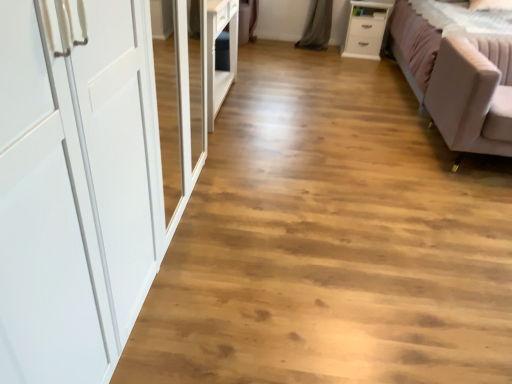
The image size is (512, 384). What do you see at coordinates (331, 240) in the screenshot?
I see `matte white wardrobe at left` at bounding box center [331, 240].

Image resolution: width=512 pixels, height=384 pixels. I want to click on white glossy chest of drawers at upper right, so click(x=365, y=28).

Where is `plain below the white glossy chest of drawers at upper right (from the image's perspective)`? This screenshot has width=512, height=384. plain below the white glossy chest of drawers at upper right (from the image's perspective) is located at coordinates click(x=331, y=240).

Based on the photo, considering the sizes of objects matte white wardrobe at left and white glossy chest of drawers at upper right in the image provided, who is shorter, matte white wardrobe at left or white glossy chest of drawers at upper right?

matte white wardrobe at left.

Does matte white wardrobe at left have a lesser width compared to white glossy chest of drawers at upper right?

No.

Which is correct: matte white wardrobe at left is inside white glossy chest of drawers at upper right, or outside of it?

matte white wardrobe at left exists outside the volume of white glossy chest of drawers at upper right.

Can matte white wardrobe at left be found inside white glossy chest of drawers at upper right?

No, white glossy chest of drawers at upper right does not contain matte white wardrobe at left.

From the image's perspective, does white glossy chest of drawers at upper right appear higher than matte white wardrobe at left?

Yes, from the image's perspective, white glossy chest of drawers at upper right is over matte white wardrobe at left.

Can you tell me how much white glossy chest of drawers at upper right and matte white wardrobe at left differ in facing direction?

The angle between the facing direction of white glossy chest of drawers at upper right and the facing direction of matte white wardrobe at left is 1.02 degrees.

Between point (360, 15) and point (374, 221), which one is positioned in front?

The point (374, 221) is more forward.

Considering the relative positions of white glossy chest of drawers at upper right and light pink fabric studio couch at right in the image provided, is white glossy chest of drawers at upper right to the right of light pink fabric studio couch at right from the viewer's perspective?

Incorrect, white glossy chest of drawers at upper right is not on the right side of light pink fabric studio couch at right.

Between point (371, 58) and point (494, 132), which one is positioned in front?

The point (494, 132) is in front.

In the scene shown: From a real-world perspective, which object rests below the other?

From a 3D spatial view, white glossy chest of drawers at upper right is below.

Can you confirm if white glossy chest of drawers at upper right is bigger than light pink fabric studio couch at right?

Incorrect, white glossy chest of drawers at upper right is not larger than light pink fabric studio couch at right.

Is point (466, 74) behind point (451, 344)?

Yes, it is.

Considering the sizes of light pink fabric studio couch at right and matte white wardrobe at left in the image, is light pink fabric studio couch at right bigger or smaller than matte white wardrobe at left?

Clearly, light pink fabric studio couch at right is larger in size than matte white wardrobe at left.

In terms of height, does light pink fabric studio couch at right look taller or shorter compared to matte white wardrobe at left?

Considering their sizes, light pink fabric studio couch at right has more height than matte white wardrobe at left.

Are light pink fabric studio couch at right and matte white wardrobe at left making contact?

No, light pink fabric studio couch at right is not in contact with matte white wardrobe at left.

Does light pink fabric studio couch at right contain white glossy chest of drawers at upper right?

Definitely not — white glossy chest of drawers at upper right is not inside light pink fabric studio couch at right.

Is light pink fabric studio couch at right facing towards white glossy chest of drawers at upper right?

No, light pink fabric studio couch at right is not aimed at white glossy chest of drawers at upper right.

From a real-world perspective, does light pink fabric studio couch at right sit lower than white glossy chest of drawers at upper right?

No, from a real-world perspective, light pink fabric studio couch at right is not under white glossy chest of drawers at upper right.

Is light pink fabric studio couch at right not close to white glossy chest of drawers at upper right?

Yes.

Which point is more forward, (255, 135) or (423, 63)?

The point (255, 135) is in front.

Does matte white wardrobe at left have a lesser height compared to light pink fabric studio couch at right?

Indeed, matte white wardrobe at left has a lesser height compared to light pink fabric studio couch at right.

Is matte white wardrobe at left positioned far away from light pink fabric studio couch at right?

They are positioned close to each other.

Image resolution: width=512 pixels, height=384 pixels. I want to click on plain in front of the white glossy chest of drawers at upper right, so click(331, 240).

Locate an element on the screen. The width and height of the screenshot is (512, 384). the chest of drawers that is above the matte white wardrobe at left (from the image's perspective) is located at coordinates (365, 28).

Looking at the image, which one is located closer to white glossy chest of drawers at upper right, matte white wardrobe at left or light pink fabric studio couch at right?

The object closer to white glossy chest of drawers at upper right is light pink fabric studio couch at right.

Estimate the real-world distances between objects in this image. Which object is closer to matte white wardrobe at left, white glossy chest of drawers at upper right or light pink fabric studio couch at right?

Based on the image, light pink fabric studio couch at right appears to be nearer to matte white wardrobe at left.

When comparing their distances from light pink fabric studio couch at right, does matte white wardrobe at left or white glossy chest of drawers at upper right seem further?

The object further to light pink fabric studio couch at right is white glossy chest of drawers at upper right.

Estimate the real-world distances between objects in this image. Which object is closer to light pink fabric studio couch at right, white glossy chest of drawers at upper right or matte white wardrobe at left?

Among the two, matte white wardrobe at left is located nearer to light pink fabric studio couch at right.

Considering their positions, is light pink fabric studio couch at right positioned further to matte white wardrobe at left than white glossy chest of drawers at upper right?

white glossy chest of drawers at upper right lies further to matte white wardrobe at left than the other object.

From the image, which object appears to be farther from white glossy chest of drawers at upper right, light pink fabric studio couch at right or matte white wardrobe at left?

Among the two, matte white wardrobe at left is located further to white glossy chest of drawers at upper right.

The image size is (512, 384). What are the coordinates of `studio couch positioned between matte white wardrobe at left and white glossy chest of drawers at upper right from near to far` in the screenshot? It's located at (459, 71).